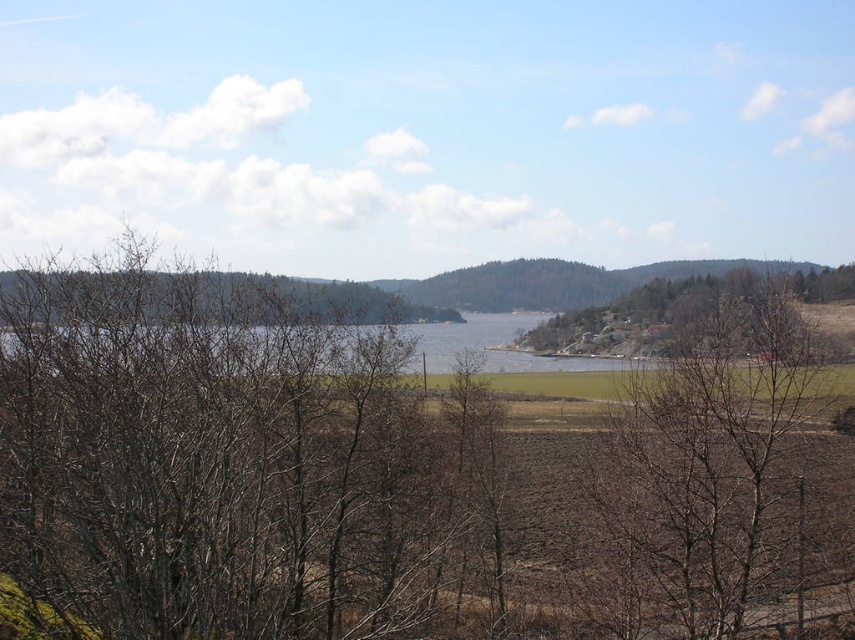
You are an artist sketching the landscape and want to draw the brown bare branches at center and the brown leafless tree at right. Which one should you sketch first if you are following the left to right direction?

You should sketch the brown bare branches at center first because it is to the left of the brown leafless tree at right.

You are standing in the serene landscape and want to walk from the point closer to you to the point further away. Which path would you take between the two points listed below? Please choose the correct pair of points based on their distance from you. The points are labeled as follows. The first point is at coordinates point (99, 304), and the second point is at point (677, 310). Which one is closer to you?

Point (99, 304) is closer to the viewer than point (677, 310). Therefore, you should start at point (99, 304) and walk towards point (677, 310).